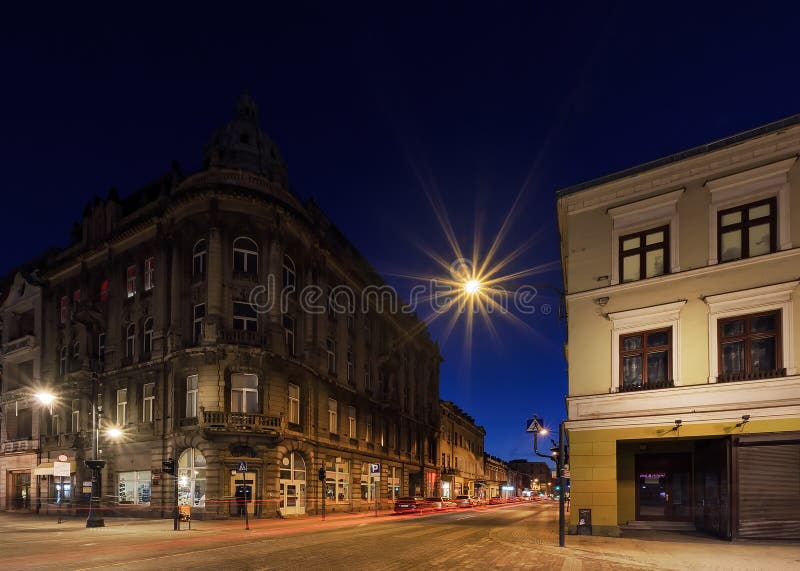
Image resolution: width=800 pixels, height=571 pixels. Identify the location of door glass with white frame. (290, 493).